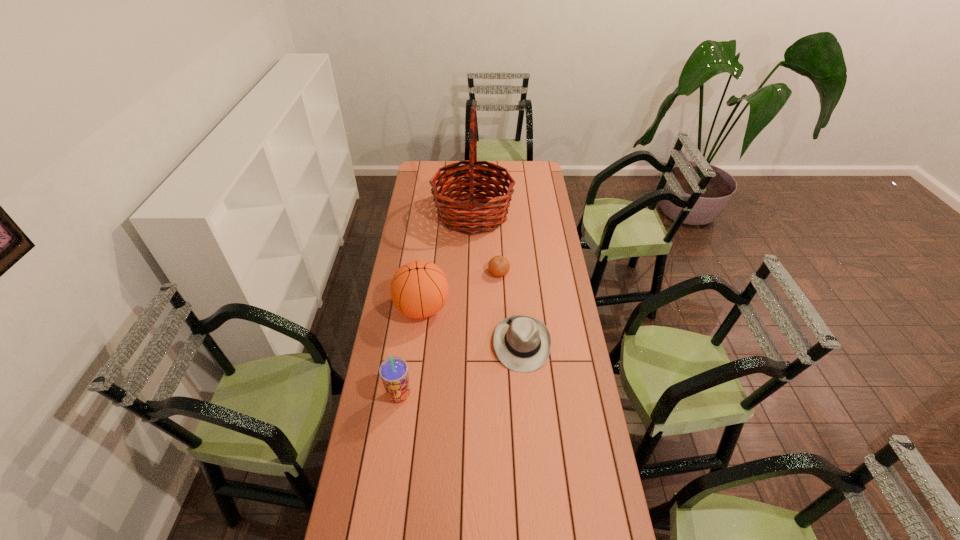
Find the location of `free location located 0.280m on the front-facing side of the fourth tallest object`. free location located 0.280m on the front-facing side of the fourth tallest object is located at coordinates (530, 444).

Image resolution: width=960 pixels, height=540 pixels. Identify the location of vacant point located on the back of the shortest object. (497, 242).

The width and height of the screenshot is (960, 540). Find the location of `basket that is at the left edge`. basket that is at the left edge is located at coordinates 468,217.

Identify the location of smoothie positioned at the left edge. This screenshot has width=960, height=540. [x=393, y=371].

Locate an element on the screen. This screenshot has height=540, width=960. basketball that is positioned at the left edge is located at coordinates (419, 289).

I want to click on object that is positioned at the right edge, so click(522, 343).

Identify the location of vacant space at the left edge of the desktop. (396, 458).

At what (x,y) coordinates should I click in order to perform the action: click on vacant region at the right edge of the desktop. Please return your answer as a coordinate pair (x, y). Looking at the image, I should click on (x=555, y=320).

Where is `vacant space at the far right corner of the desktop`? The height and width of the screenshot is (540, 960). vacant space at the far right corner of the desktop is located at coordinates (530, 181).

The image size is (960, 540). Find the location of `unoccupied area between the second farthest object and the farthest object`. unoccupied area between the second farthest object and the farthest object is located at coordinates (486, 244).